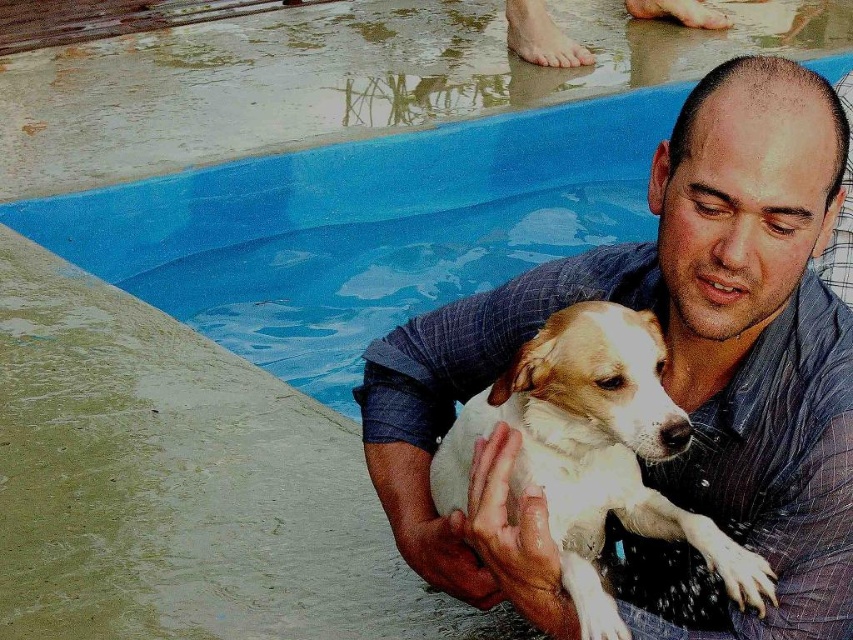
Can you confirm if blue plastic swimming pool at upper center is positioned to the left of white fur dog at center?

Yes, blue plastic swimming pool at upper center is to the left of white fur dog at center.

Between blue plastic swimming pool at upper center and white fur dog at center, which one appears on the left side from the viewer's perspective?

blue plastic swimming pool at upper center is more to the left.

Does point (281, 356) come closer to viewer compared to point (660, 422)?

No, (281, 356) is behind (660, 422).

Where is `blue plastic swimming pool at upper center`? blue plastic swimming pool at upper center is located at coordinates (363, 228).

Who is shorter, blue plaid shirt at upper right or white fur dog at center?

Standing shorter between the two is white fur dog at center.

Is point (828, 332) positioned after point (625, 451)?

No, it is not.

At what (x,y) coordinates should I click in order to perform the action: click on blue plaid shirt at upper right. Please return your answer as a coordinate pair (x, y). Looking at the image, I should click on (666, 378).

Is point (784, 243) less distant than point (573, 170)?

Yes, it is in front of point (573, 170).

Between point (387, 451) and point (456, 216), which one is positioned in front?

Point (387, 451) is in front.

Who is more forward, (666, 586) or (180, 296)?

Positioned in front is point (666, 586).

Find the location of `blue plaid shirt at upper right`. blue plaid shirt at upper right is located at coordinates (666, 378).